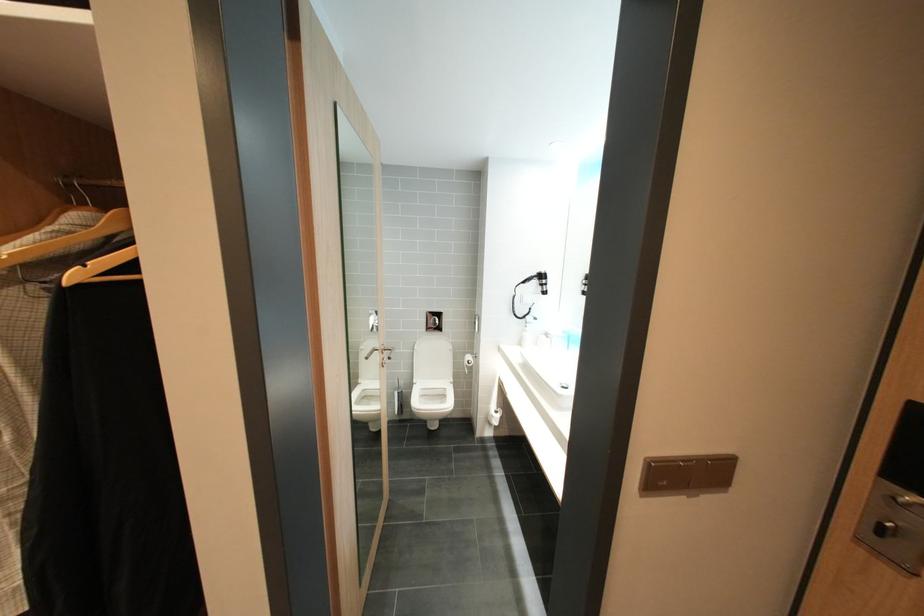
I want to click on silver door handle, so click(x=893, y=525).